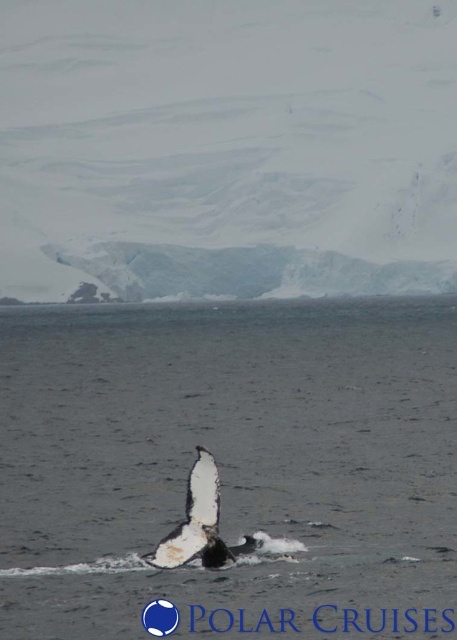
You are a marine biologist observing the scene from a research vessel. You notice the clear water at center and the white matte whale at center. Which object is closer to your observation point?

The clear water at center is closer to the observation point because it is further to the viewer than the white matte whale at center.

You are a marine biologist observing this Antarctic scene. You need to determine which object, the clear water at center or the white matte whale at center, is higher in the image. Based on your observation, which one is taller?

The clear water at center is taller than the white matte whale at center according to the description.

You are a researcher studying the spatial distribution of water clarity in the Antarctic region. You observe the clear water at center in the image. Based on its coordinates, can you determine if it is positioned closer to the foreground whale or the background iceberg?

The clear water at center is located at point (226,456), which places it closer to the foreground whale than the background iceberg.